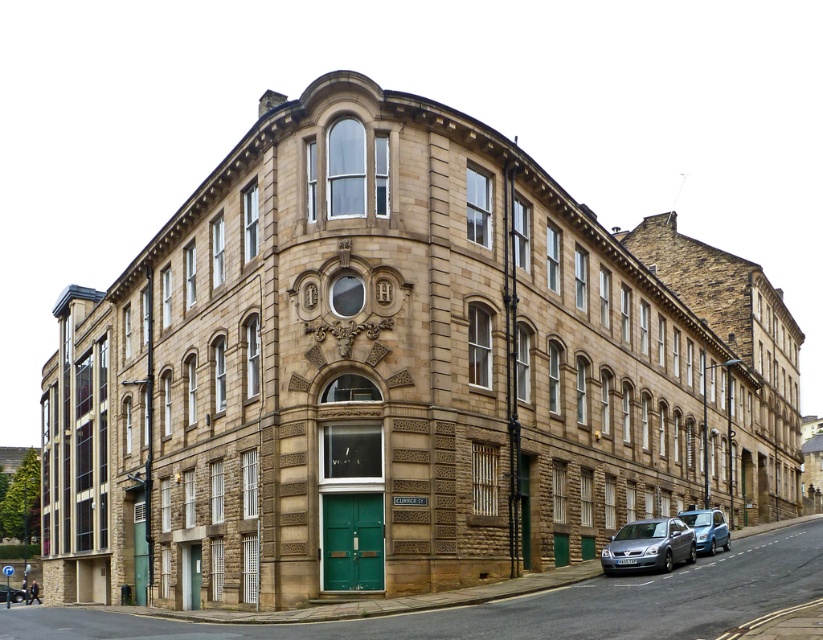
Is metallic blue car at lower right positioned at the back of metallic silver car at lower left?

No, metallic blue car at lower right is closer to the viewer.

Between metallic blue car at lower right and metallic silver car at lower left, which one appears on the left side from the viewer's perspective?

From the viewer's perspective, metallic silver car at lower left appears more on the left side.

Locate an element on the screen. metallic blue car at lower right is located at coordinates (707, 529).

Which of these two, silver metallic car at lower right or metallic silver car at lower left, stands taller?

metallic silver car at lower left

Can you confirm if silver metallic car at lower right is thinner than metallic silver car at lower left?

Indeed, silver metallic car at lower right has a lesser width compared to metallic silver car at lower left.

Does point (649, 548) lie in front of point (19, 596)?

Yes.

In order to click on silver metallic car at lower right in this screenshot , I will do `click(649, 545)`.

How distant is silver metallic car at lower right from metallic blue car at lower right?

The distance of silver metallic car at lower right from metallic blue car at lower right is 20.60 feet.

Which is below, silver metallic car at lower right or metallic blue car at lower right?

metallic blue car at lower right

Who is more distant from viewer, (x=617, y=557) or (x=710, y=552)?

Point (x=710, y=552)

Find the location of a particular element. This screenshot has height=640, width=823. silver metallic car at lower right is located at coordinates (649, 545).